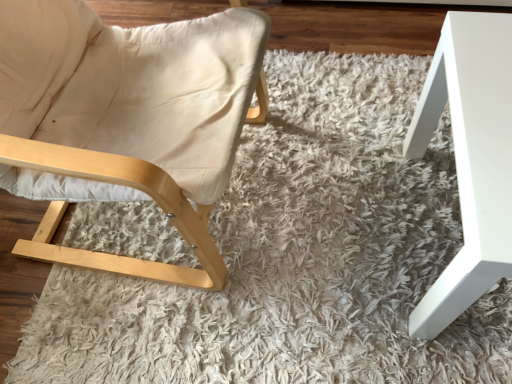
You are a GUI agent. You are given a task and a screenshot of the screen. Output one action in this format:
    pyautogui.click(x=<x>, y=<y>)
    Task: Click on the vacant area situated to the left side of white glossy table at right
    The width and height of the screenshot is (512, 384).
    Given the screenshot: What is the action you would take?
    pyautogui.click(x=318, y=245)